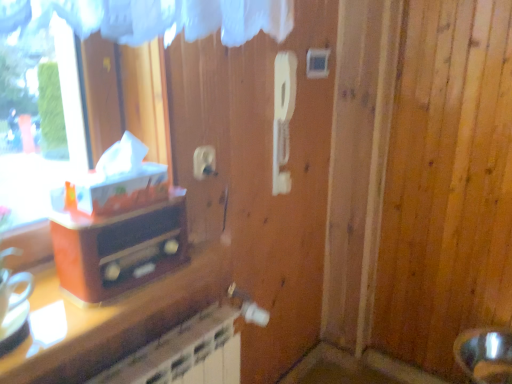
Question: Does point click(x=151, y=271) appear closer or farther from the camera than point click(x=310, y=61)?

Choices:
 (A) closer
 (B) farther

Answer: (A)

Question: Considering the positions of matte orange radio at left and white plastic light switch at upper center in the image, is matte orange radio at left wider or thinner than white plastic light switch at upper center?

Choices:
 (A) thin
 (B) wide

Answer: (B)

Question: Which object is positioned farthest from the matte orange radio at left?

Choices:
 (A) white plastic light switch at upper center
 (B) white plastic electric outlet at upper center

Answer: (A)

Question: Considering the real-world distances, which object is farthest from the white plastic light switch at upper center?

Choices:
 (A) matte orange radio at left
 (B) white plastic electric outlet at upper center

Answer: (A)